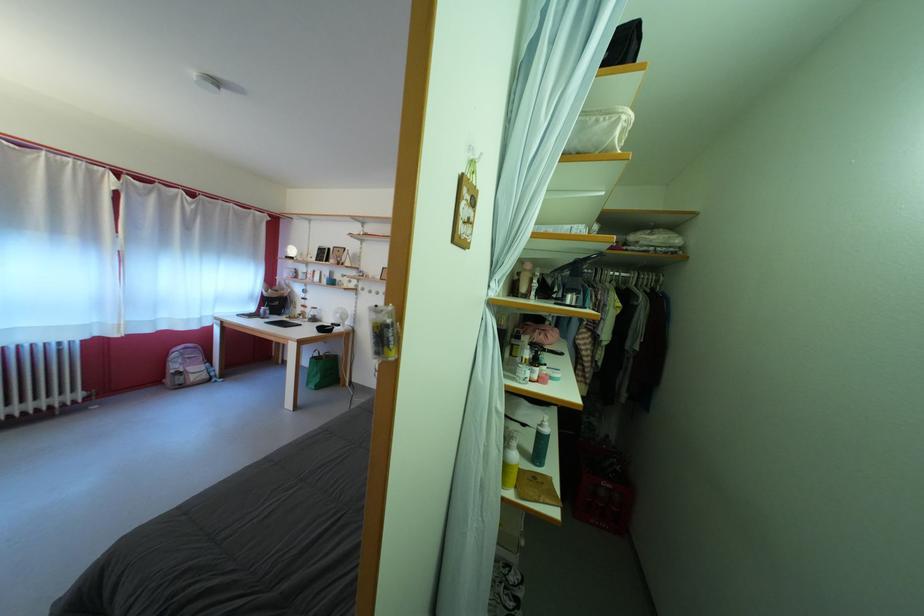
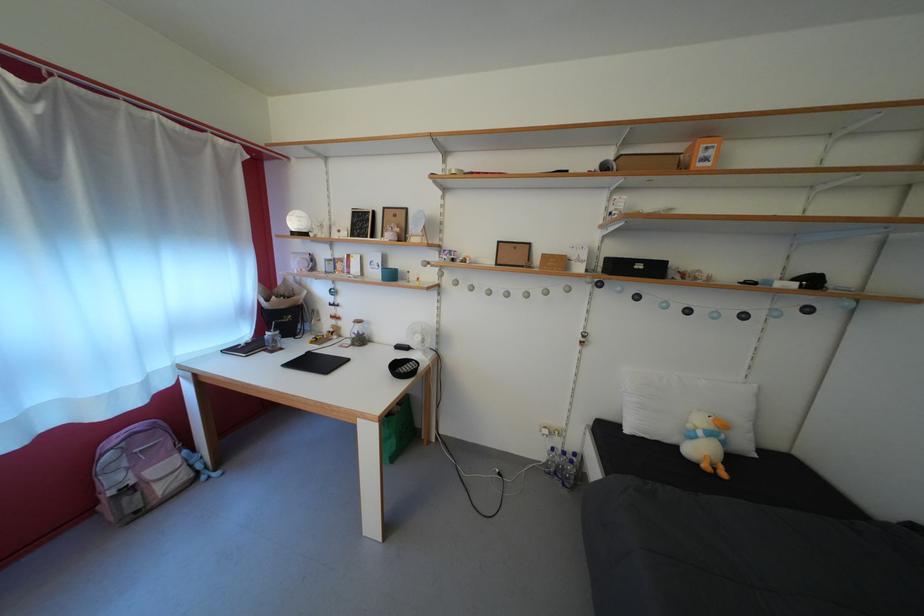
Locate, in the second image, the point that corresponds to the point at 319,318 in the first image.

(358, 334)